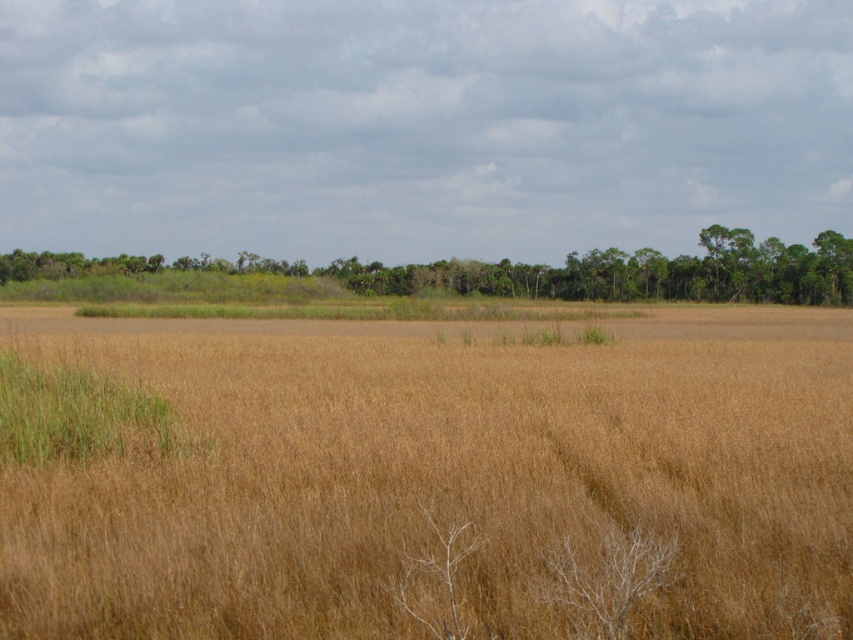
You are a hiker trying to navigate through the brown grassland at center and the green leafy trees at center. Which area would you choose to walk through if you want to avoid taller vegetation?

The brown grassland at center is not as tall as the green leafy trees at center, so you should choose the brown grassland at center to avoid taller vegetation.

You are standing at the point labeled as point (426, 476) in the image. Based on the scene description, what type of terrain are you currently standing on?

The point (426, 476) indicates brown grassland at center, so you are standing on brown grassland terrain.